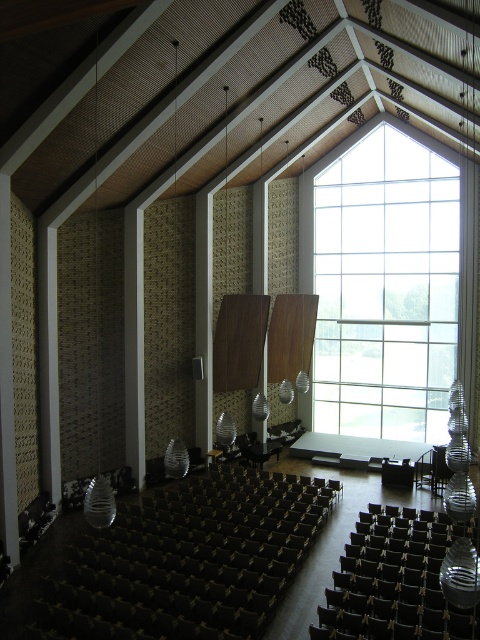
Question: In this image, where is clear glass window at upper center located relative to black leather chair at lower center?

Choices:
 (A) below
 (B) above

Answer: (B)

Question: Which object appears farthest from the camera in this image?

Choices:
 (A) clear glass window at upper center
 (B) black leather chair at lower center

Answer: (A)

Question: Can you confirm if clear glass window at upper center is wider than black leather chair at lower center?

Choices:
 (A) yes
 (B) no

Answer: (A)

Question: Considering the relative positions of clear glass window at upper center and black leather chair at lower center in the image provided, where is clear glass window at upper center located with respect to black leather chair at lower center?

Choices:
 (A) below
 (B) above

Answer: (B)

Question: Which point is farther from the camera taking this photo?

Choices:
 (A) (427, 141)
 (B) (396, 518)

Answer: (A)

Question: Which point is closer to the camera?

Choices:
 (A) clear glass window at upper center
 (B) black leather chair at lower center

Answer: (B)